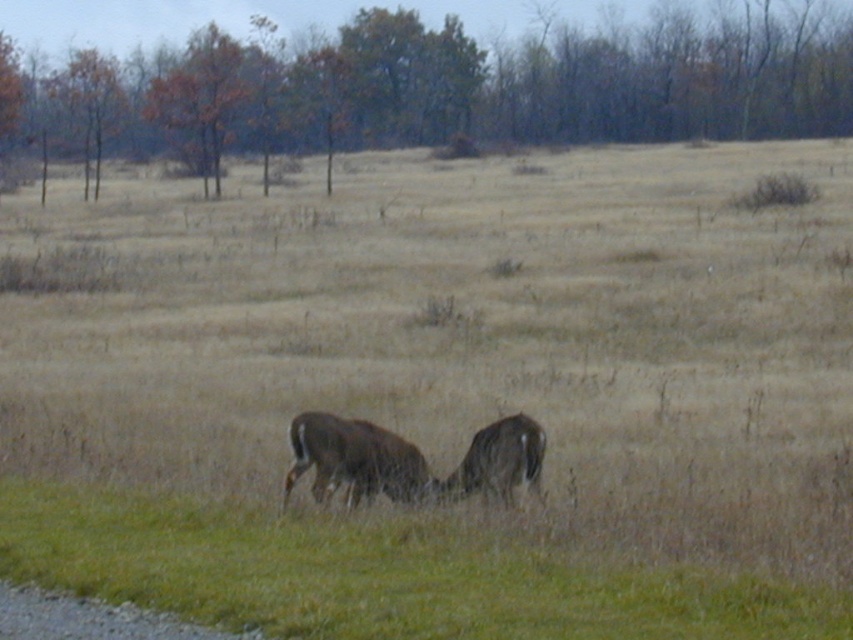
Between green grass at lower center and brown fur deer at center, which one appears on the left side from the viewer's perspective?

green grass at lower center

Which of these two, green grass at lower center or brown fur deer at center, stands taller?

Standing taller between the two is brown fur deer at center.

The height and width of the screenshot is (640, 853). I want to click on green grass at lower center, so click(375, 577).